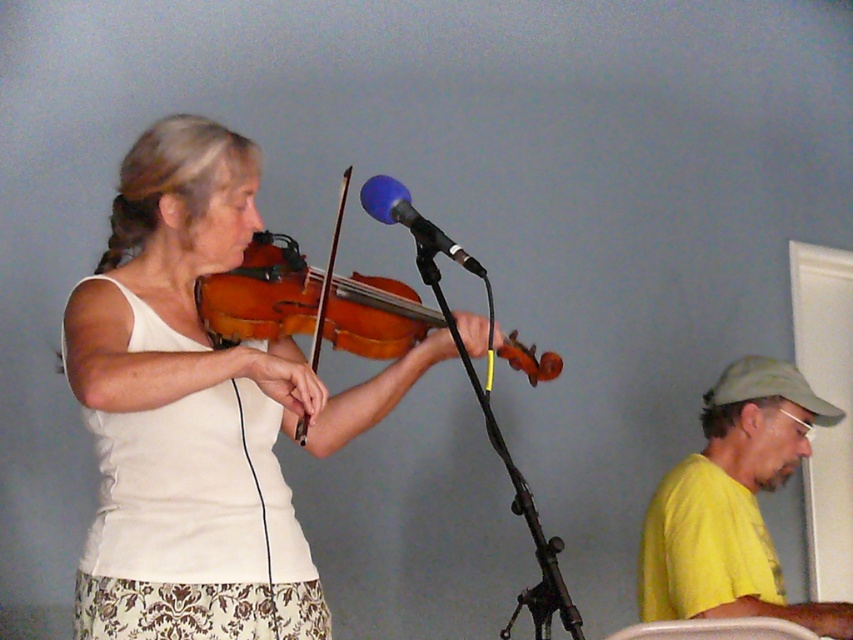
Can you confirm if matte wood violin at center is shorter than yellow matte shirt at lower right?

In fact, matte wood violin at center may be taller than yellow matte shirt at lower right.

Between matte wood violin at center and yellow matte shirt at lower right, which one is positioned higher?

matte wood violin at center is higher up.

Does point (267, 508) come in front of point (723, 465)?

Yes, it is.

The height and width of the screenshot is (640, 853). I want to click on matte wood violin at center, so click(198, 412).

Is matte wood violin at center positioned in front of wooden violin at center?

Yes, matte wood violin at center is in front of wooden violin at center.

In the scene shown: Is matte wood violin at center below wooden violin at center?

Yes.

Does point (254, 586) lie in front of point (418, 305)?

That is True.

Where is `matte wood violin at center`? This screenshot has width=853, height=640. matte wood violin at center is located at coordinates (198, 412).

Is matte wood violin at center above blue foam microphone at center?

Incorrect, matte wood violin at center is not positioned above blue foam microphone at center.

Consider the image. Does matte wood violin at center appear under blue foam microphone at center?

Yes, matte wood violin at center is below blue foam microphone at center.

This screenshot has width=853, height=640. In order to click on matte wood violin at center in this screenshot , I will do `click(198, 412)`.